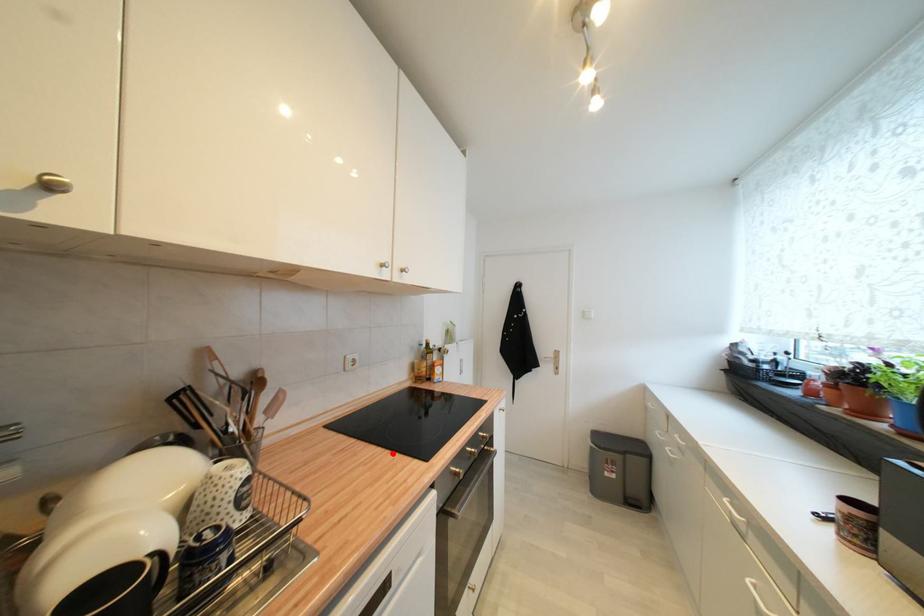
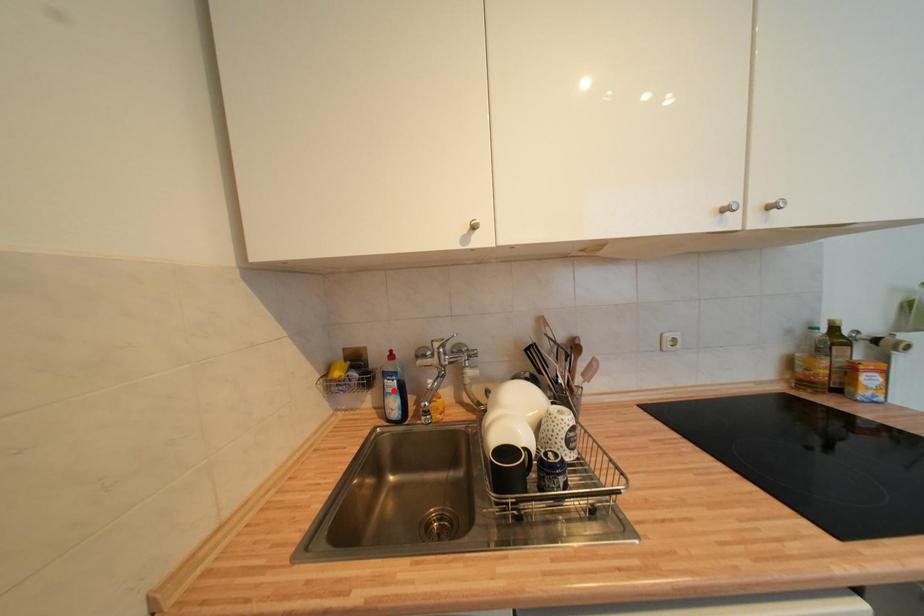
I am providing you with two images of the same scene from different viewpoints. A red point is marked on the first image and another point is marked on the second image. Does the point marked in image1 correspond to the same location as the one in image2?

No